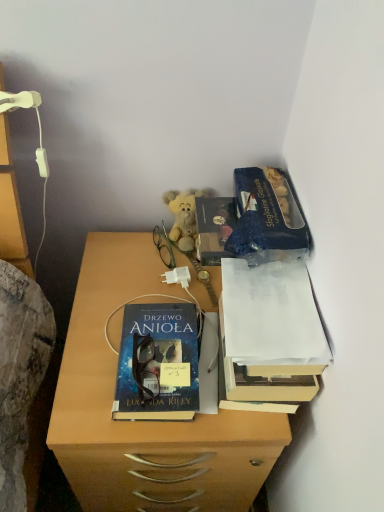
At what (x,y) coordinates should I click in order to perform the action: click on free point above blue glossy book at center, the first book viewed from the left (from a real-world perspective). Please return your answer as a coordinate pair (x, y). The height and width of the screenshot is (512, 384). Looking at the image, I should click on (159, 348).